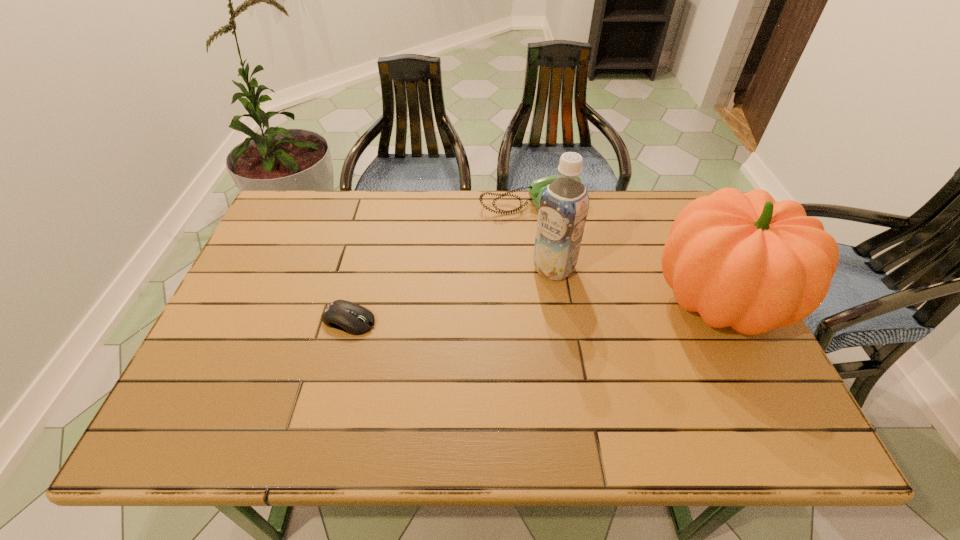
The width and height of the screenshot is (960, 540). Identify the location of the leftmost object. (354, 319).

Where is `the shortest object`? This screenshot has width=960, height=540. the shortest object is located at coordinates (354, 319).

The height and width of the screenshot is (540, 960). I want to click on pumpkin, so click(747, 261).

Identify the location of telephone. This screenshot has height=540, width=960. (537, 187).

Identify the location of the third tallest object. pos(537,187).

You are a GUI agent. You are given a task and a screenshot of the screen. Output one action in this format:
    pyautogui.click(x=<x>, y=<y>)
    Task: Click on the soya milk
    The width and height of the screenshot is (960, 540).
    Given the screenshot: What is the action you would take?
    pyautogui.click(x=564, y=204)

I want to click on vacant space located 0.340m on the back of the leftmost object, so click(374, 220).

In order to click on free space located on the back of the pumpkin in this screenshot , I will do `click(666, 196)`.

Locate an element on the screen. The height and width of the screenshot is (540, 960). vacant space located on the dial of the third tallest object is located at coordinates coord(556,238).

The width and height of the screenshot is (960, 540). I want to click on free space located on the dial of the third tallest object, so click(597, 312).